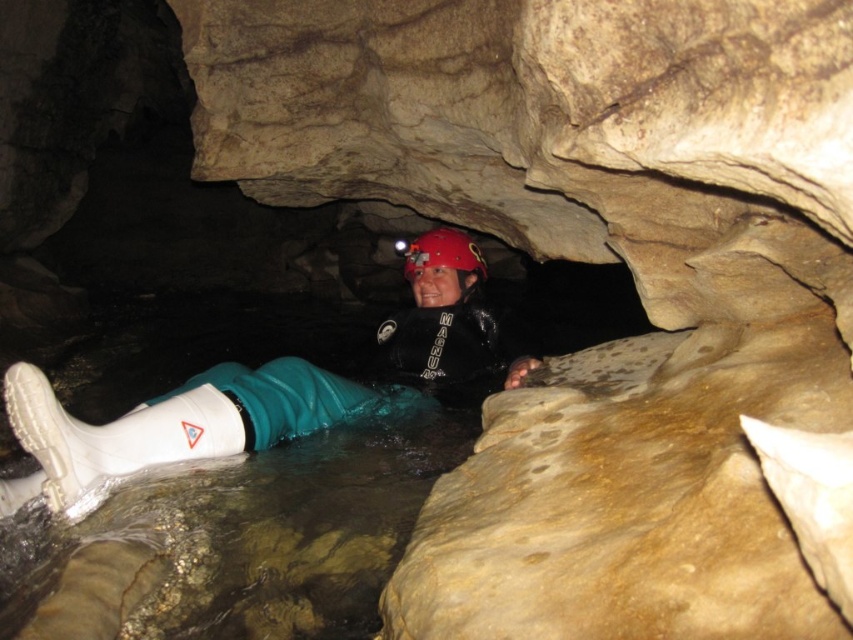
You are a caver who just entered the cave and is facing the direction shown in the image. You need to place a small marker between the white rubber boot at lower left and the red matte helmet at center. Where should you place the marker so it is closer to the front object?

The white rubber boot at lower left is in front of the red matte helmet at center, so place the marker closer to the white rubber boot at lower left to be near the front object.

You are a cave explorer who needs to place a marker at the exact location of the white rubber boot at lower left. What are the coordinates where you should place the marker?

The coordinates for the white rubber boot at lower left are at point [171,422].